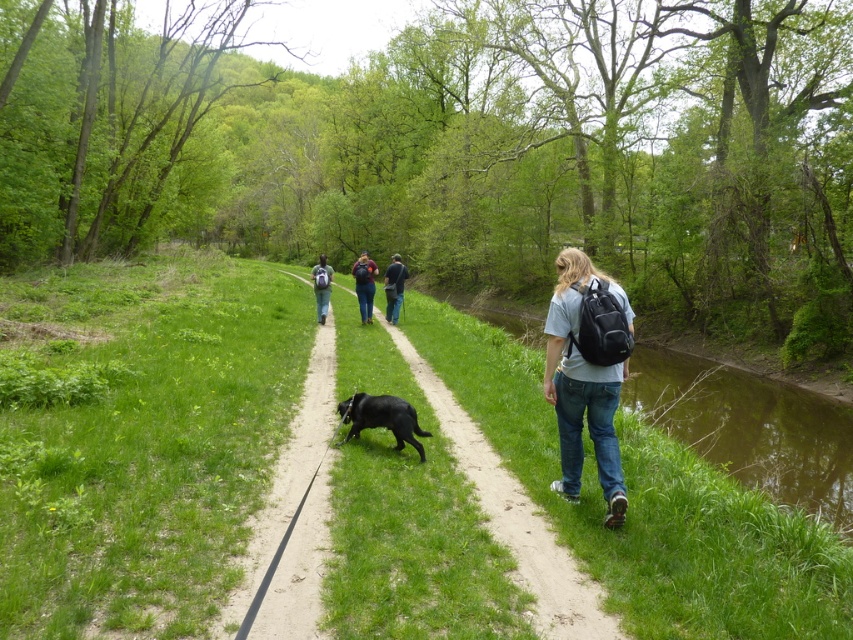
Question: Estimate the real-world distances between objects in this image. Which object is farther from the matte blue jeans at center?

Choices:
 (A) dirt path at center
 (B) matte black backpack at right
 (C) black rubber dog at center

Answer: (B)

Question: Among these objects, which one is nearest to the camera?

Choices:
 (A) green grassy river at right
 (B) dark blue jeans at center

Answer: (A)

Question: Observing the image, what is the correct spatial positioning of matte black backpack at right in reference to shiny black dog at center?

Choices:
 (A) above
 (B) below

Answer: (B)

Question: Is dark blue jeans at center bigger than matte black backpack at center?

Choices:
 (A) yes
 (B) no

Answer: (B)

Question: Which point is closer to the camera?

Choices:
 (A) matte blue jeans at center
 (B) dirt path at center
 (C) shiny black dog at center

Answer: (B)

Question: Does matte black backpack at right appear on the right side of shiny black dog at center?

Choices:
 (A) yes
 (B) no

Answer: (A)